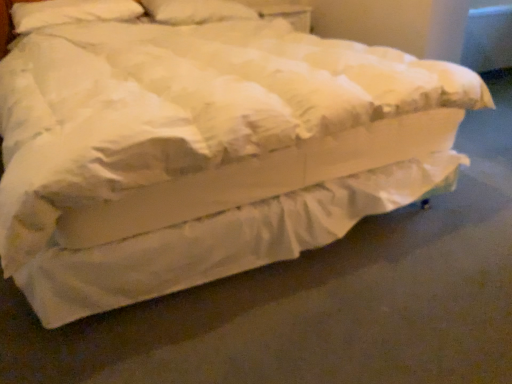
Question: Do you think white soft pillow at upper center, acting as the second pillow starting from the left, is within white soft pillow at upper left, the second pillow viewed from the right, or outside of it?

Choices:
 (A) inside
 (B) outside

Answer: (B)

Question: Is white soft pillow at upper center, the first pillow from the right, in front of or behind white soft pillow at upper left, the second pillow viewed from the right, in the image?

Choices:
 (A) behind
 (B) front

Answer: (A)

Question: From a real-world perspective, relative to white soft pillow at upper left, arranged as the first pillow when viewed from the left, is white soft pillow at upper center, acting as the second pillow starting from the left, vertically above or below?

Choices:
 (A) above
 (B) below

Answer: (B)

Question: Does point (25, 18) appear closer or farther from the camera than point (153, 16)?

Choices:
 (A) farther
 (B) closer

Answer: (B)

Question: In terms of width, does white soft pillow at upper left, arranged as the first pillow when viewed from the left, look wider or thinner when compared to white soft pillow at upper center, the first pillow from the right?

Choices:
 (A) thin
 (B) wide

Answer: (A)

Question: Is white soft pillow at upper left, arranged as the first pillow when viewed from the left, spatially inside white soft pillow at upper center, acting as the second pillow starting from the left, or outside of it?

Choices:
 (A) outside
 (B) inside

Answer: (A)

Question: From the image's perspective, is white soft pillow at upper left, arranged as the first pillow when viewed from the left, located above or below white soft pillow at upper center, the first pillow from the right?

Choices:
 (A) below
 (B) above

Answer: (A)